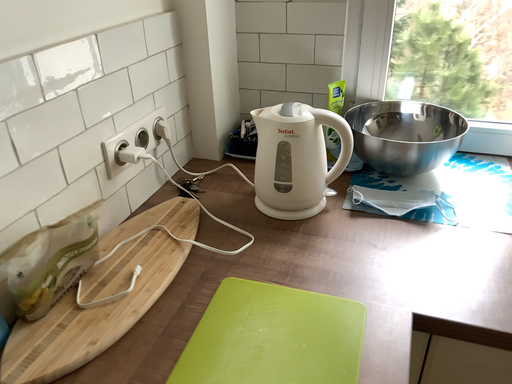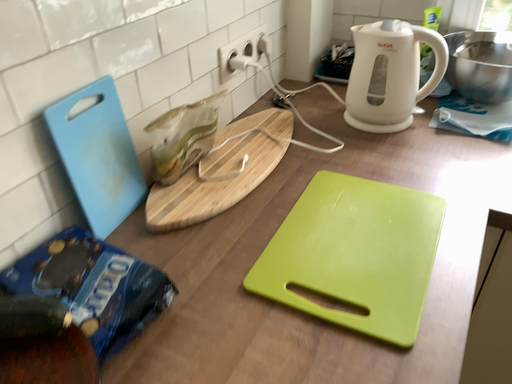
Question: Which way did the camera rotate in the video?

Choices:
 (A) rotated left
 (B) rotated right

Answer: (A)